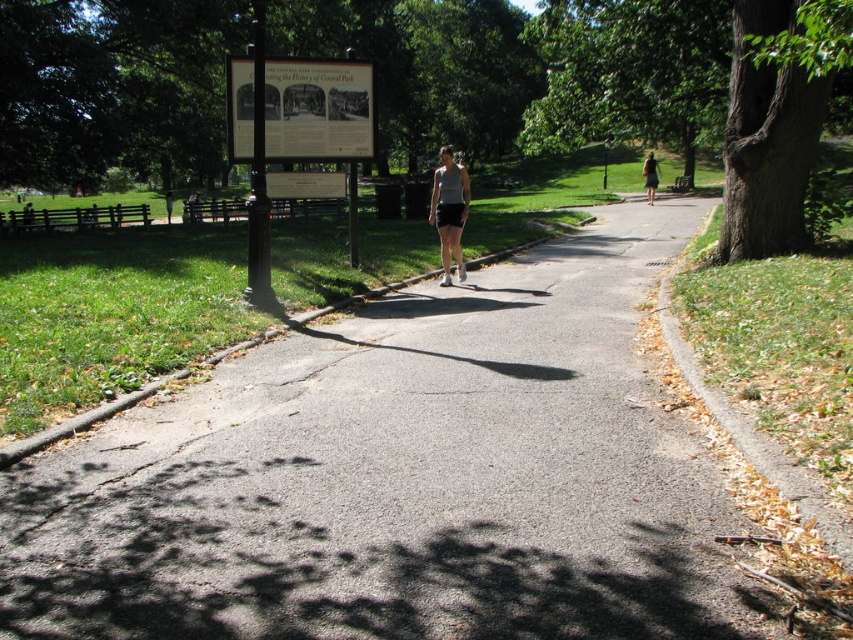
Can you confirm if wooden signboard at upper center is positioned to the right of matte black shorts at center?

Indeed, wooden signboard at upper center is positioned on the right side of matte black shorts at center.

Who is more distant from viewer, (288, 129) or (170, 205)?

The point (170, 205) is more distant.

Image resolution: width=853 pixels, height=640 pixels. Find the location of `wooden signboard at upper center`. wooden signboard at upper center is located at coordinates (318, 109).

Is asphalt path at center to the right of white matte tank top at center from the viewer's perspective?

Incorrect, asphalt path at center is not on the right side of white matte tank top at center.

Is point (622, 468) farther from camera compared to point (444, 176)?

No.

Between point (111, 429) and point (460, 257), which one is positioned behind?

The point (460, 257) is behind.

Find the location of `asphalt path at center`. asphalt path at center is located at coordinates (402, 476).

Does white matte tank top at center have a greater width compared to dark green skirt at right?

Incorrect, white matte tank top at center's width does not surpass dark green skirt at right's.

Between point (444, 244) and point (651, 160), which one is positioned in front?

Point (444, 244) is in front.

The width and height of the screenshot is (853, 640). What are the coordinates of `white matte tank top at center` in the screenshot? It's located at (450, 211).